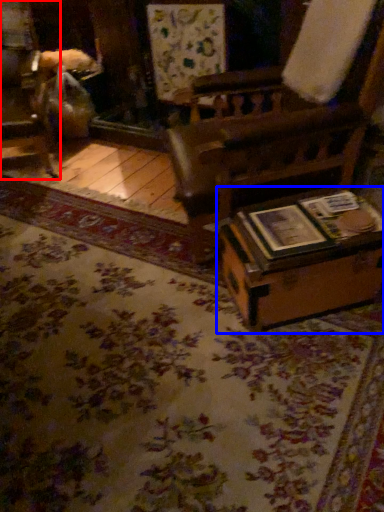
Question: Which object appears closest to the camera in this image, furniture (highlighted by a red box) or table (highlighted by a blue box)?

Choices:
 (A) furniture
 (B) table

Answer: (B)